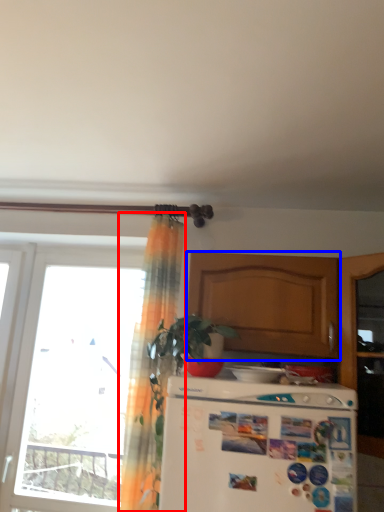
Question: Which of the following is the closest to the observer, curtain (highlighted by a red box) or cabinetry (highlighted by a blue box)?

Choices:
 (A) curtain
 (B) cabinetry

Answer: (A)